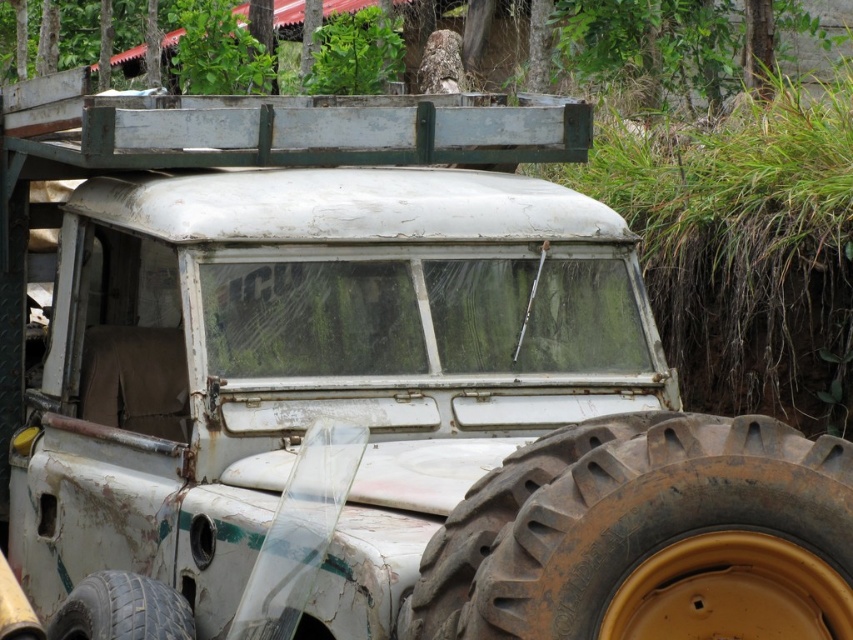
Question: Which object appears closest to the camera in this image?

Choices:
 (A) dark brown rubber tire at lower left
 (B) rusty rubber tire at lower right

Answer: (B)

Question: Does rusty rubber tire at lower right appear on the left side of dark brown rubber tire at lower left?

Choices:
 (A) yes
 (B) no

Answer: (B)

Question: Does rusty rubber tire at lower right appear over dark brown rubber tire at lower left?

Choices:
 (A) yes
 (B) no

Answer: (A)

Question: Is rusty rubber tire at lower right wider than dark brown rubber tire at lower left?

Choices:
 (A) no
 (B) yes

Answer: (B)

Question: Which of the following is the farthest from the observer?

Choices:
 (A) rusty rubber tire at lower right
 (B) dark brown rubber tire at lower left

Answer: (B)